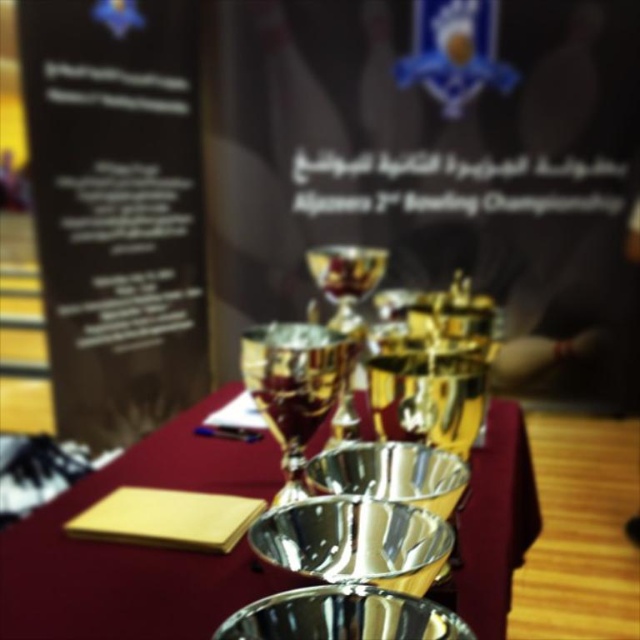
Which is in front, point (72, 296) or point (488, 490)?

Point (488, 490)

Measure the distance between black paper at left and camera.

A distance of 8.69 feet exists between black paper at left and camera.

Between point (76, 323) and point (208, 564), which one is positioned in front?

Point (208, 564) is more forward.

Locate an element on the screen. black paper at left is located at coordinates (116, 209).